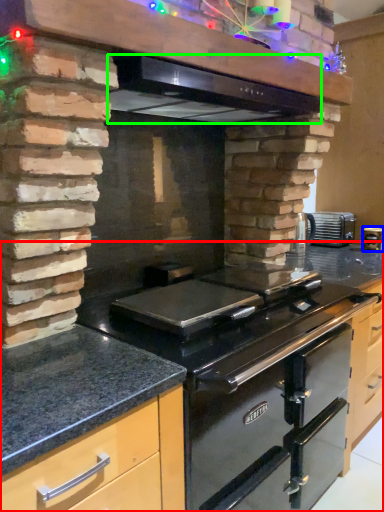
Question: Based on their relative distances, which object is farther from countertop (highlighted by a red box)? Choose from kitchen appliance (highlighted by a blue box) and exhaust hood (highlighted by a green box).

Choices:
 (A) kitchen appliance
 (B) exhaust hood

Answer: (A)